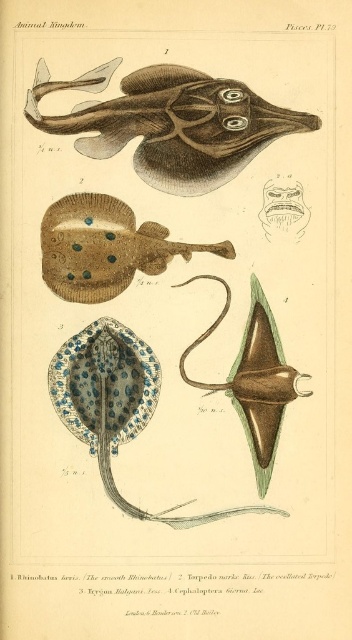
Does brown textured ray at upper center have a lesser width compared to brown textured stingray at upper center?

In fact, brown textured ray at upper center might be wider than brown textured stingray at upper center.

Can you confirm if brown textured ray at upper center is smaller than brown textured stingray at upper center?

Actually, brown textured ray at upper center might be larger than brown textured stingray at upper center.

Who is more forward, (259, 115) or (112, 253)?

Point (112, 253)

Where is `brown textured ray at upper center`? This screenshot has width=352, height=640. brown textured ray at upper center is located at coordinates (170, 122).